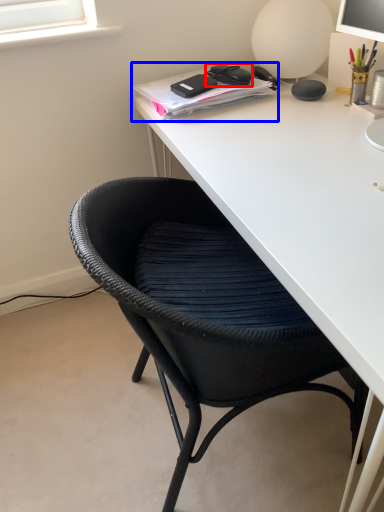
Question: Which object appears farthest to the camera in this image, stationery (highlighted by a red box) or notebook (highlighted by a blue box)?

Choices:
 (A) stationery
 (B) notebook

Answer: (A)